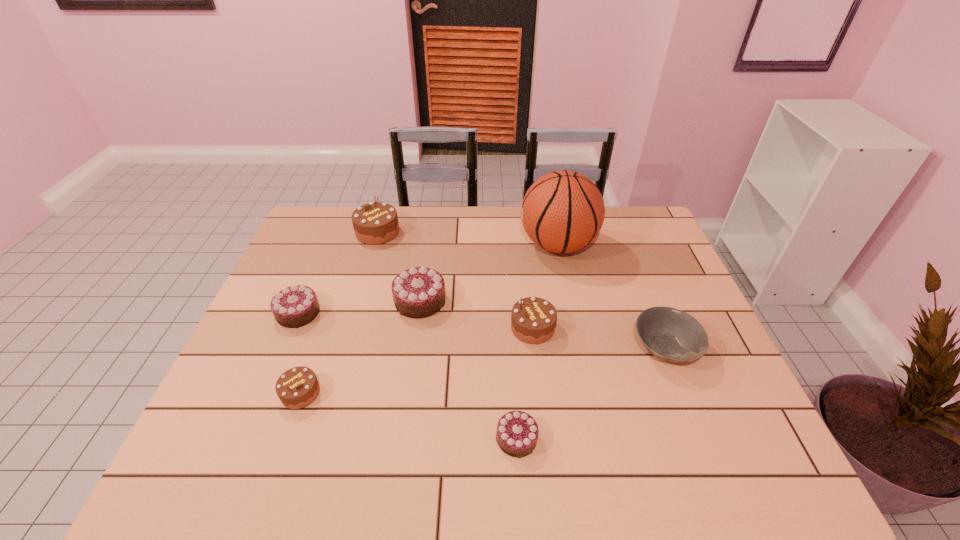
Where is `chocolate chocolate cake that can be found as the third closest to the bowl`? The height and width of the screenshot is (540, 960). chocolate chocolate cake that can be found as the third closest to the bowl is located at coordinates (295, 306).

This screenshot has width=960, height=540. Find the location of `vacant position in the image that satisfies the following two spatial constraints: 1. on the front side of the nearest chocolate chocolate cake; 2. on the right side of the biggest chocolate chocolate cake`. vacant position in the image that satisfies the following two spatial constraints: 1. on the front side of the nearest chocolate chocolate cake; 2. on the right side of the biggest chocolate chocolate cake is located at coordinates (400, 438).

Find the location of a particular element. vacant space that satisfies the following two spatial constraints: 1. on the front side of the nearest chocolate cake; 2. on the right side of the biggest chocolate chocolate cake is located at coordinates (400, 438).

At what (x,y) coordinates should I click in order to perform the action: click on vacant space that satisfies the following two spatial constraints: 1. on the side where the inflation valve is located; 2. on the front side of the rightmost brown chocolate cake. Please return your answer as a coordinate pair (x, y). The height and width of the screenshot is (540, 960). Looking at the image, I should click on (575, 328).

At what (x,y) coordinates should I click in order to perform the action: click on vacant area in the image that satisfies the following two spatial constraints: 1. on the side where the inflation valve is located; 2. on the right side of the rightmost object. Please return your answer as a coordinate pair (x, y). This screenshot has width=960, height=540. Looking at the image, I should click on (580, 348).